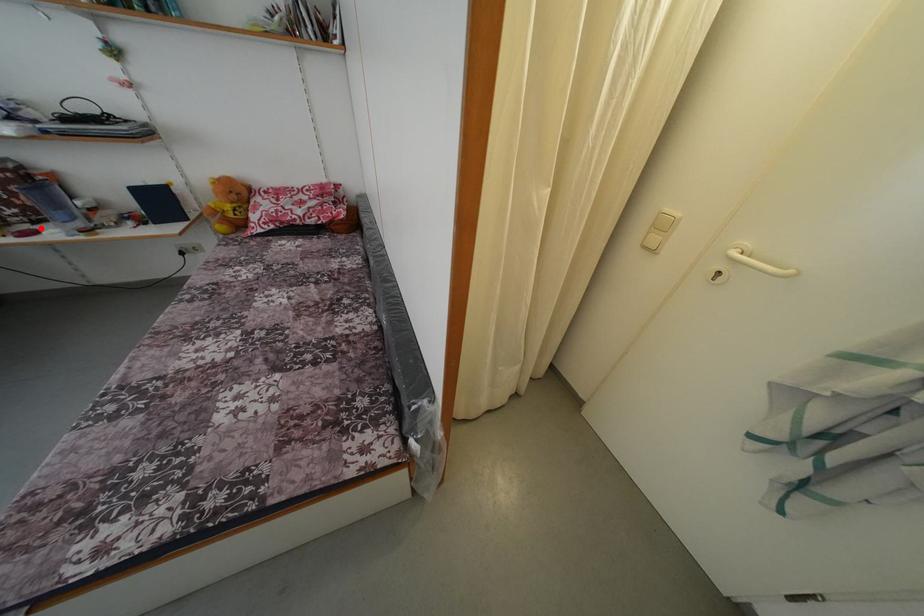
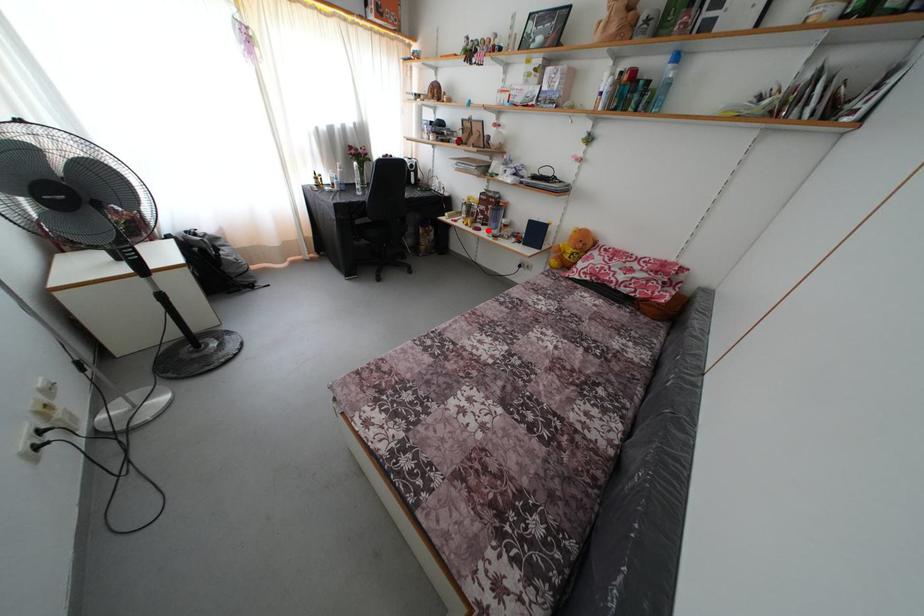
I am providing you with two images of the same scene from different viewpoints. A red point is marked on the first image and another point is marked on the second image. Does the point marked in image1 correspond to the same location as the one in image2?

Yes